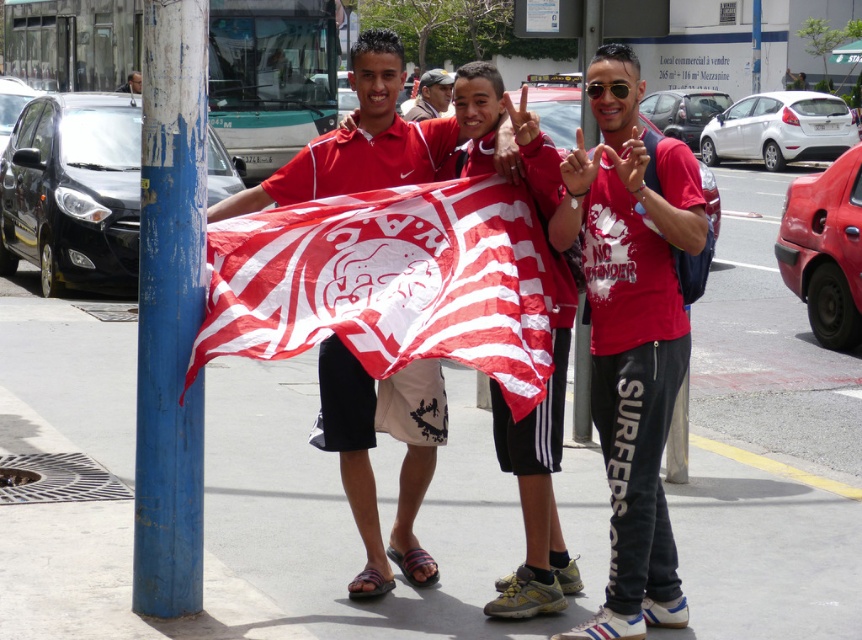
Question: Which is farther from the blue painted pole at center?

Choices:
 (A) matte black cap at center
 (B) matte red flag at center
 (C) red and white fabric flag at center

Answer: (A)

Question: Does red and white fabric flag at center appear over matte red shirt at center?

Choices:
 (A) no
 (B) yes

Answer: (B)

Question: Which point is closer to the camera?

Choices:
 (A) (431, 189)
 (B) (641, 308)

Answer: (B)

Question: Is matte red shirt at center above blue painted wood pole at left?

Choices:
 (A) yes
 (B) no

Answer: (B)

Question: Among these points, which one is nearest to the camera?

Choices:
 (A) (425, 104)
 (B) (369, 310)
 (C) (291, 168)
 (D) (589, 20)

Answer: (B)

Question: Observing the image, what is the correct spatial positioning of red and white fabric flag at center in reference to matte red shirt at center?

Choices:
 (A) right
 (B) left

Answer: (B)